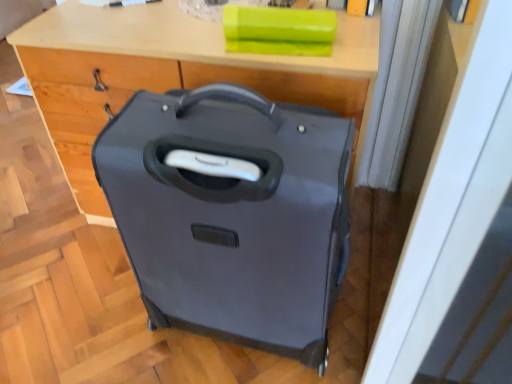
Question: From their relative heights in the image, would you say matte black suitcase at center is taller or shorter than matte wood computer desk at center?

Choices:
 (A) short
 (B) tall

Answer: (B)

Question: Considering the positions of matte black suitcase at center and matte wood computer desk at center in the image, is matte black suitcase at center wider or thinner than matte wood computer desk at center?

Choices:
 (A) wide
 (B) thin

Answer: (B)

Question: In the image, is matte black suitcase at center positioned in front of or behind matte wood computer desk at center?

Choices:
 (A) behind
 (B) front

Answer: (B)

Question: Considering the relative positions of matte wood computer desk at center and matte black suitcase at center in the image provided, is matte wood computer desk at center to the left or to the right of matte black suitcase at center?

Choices:
 (A) right
 (B) left

Answer: (B)

Question: Is matte wood computer desk at center inside or outside of matte black suitcase at center?

Choices:
 (A) outside
 (B) inside

Answer: (A)

Question: Looking at their shapes, would you say matte wood computer desk at center is wider or thinner than matte black suitcase at center?

Choices:
 (A) thin
 (B) wide

Answer: (B)

Question: From a real-world perspective, relative to matte black suitcase at center, is matte wood computer desk at center vertically above or below?

Choices:
 (A) above
 (B) below

Answer: (B)